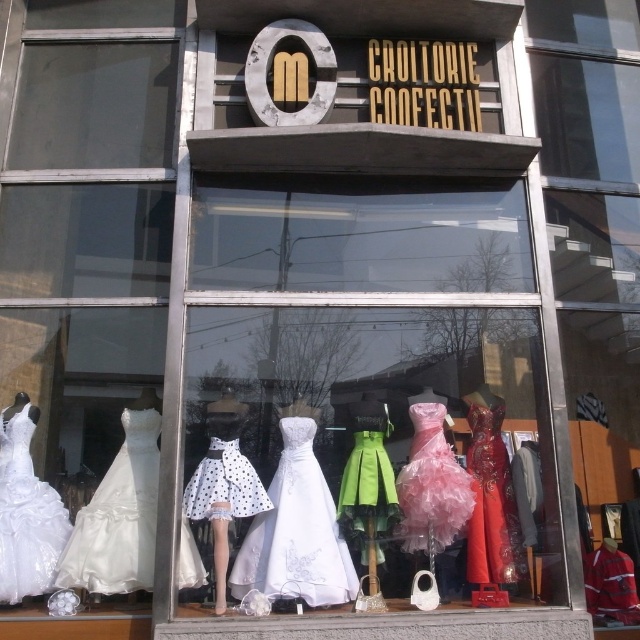
You are a customer browsing the window display of Croitorie Colectiv. You see an ivory satin dress at lower left and a white polka dot skirt at center. Which item is positioned more to the left in the display?

The ivory satin dress at lower left is positioned to the left of the white polka dot skirt at center, so it is more to the left.